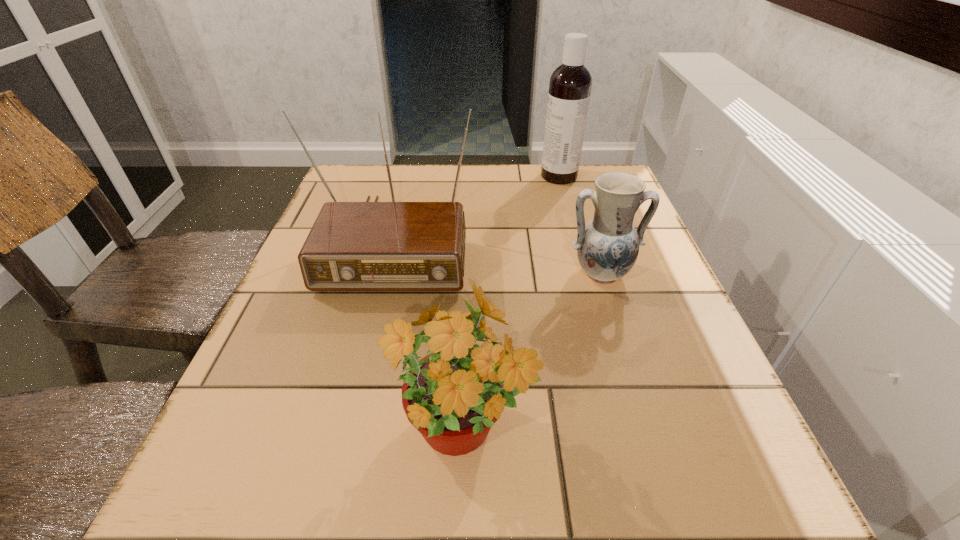
Locate an element on the screen. This screenshot has height=540, width=960. vacant position in the image that satisfies the following two spatial constraints: 1. on the front panel of the nearest object; 2. on the right side of the radio_receiver is located at coordinates (347, 435).